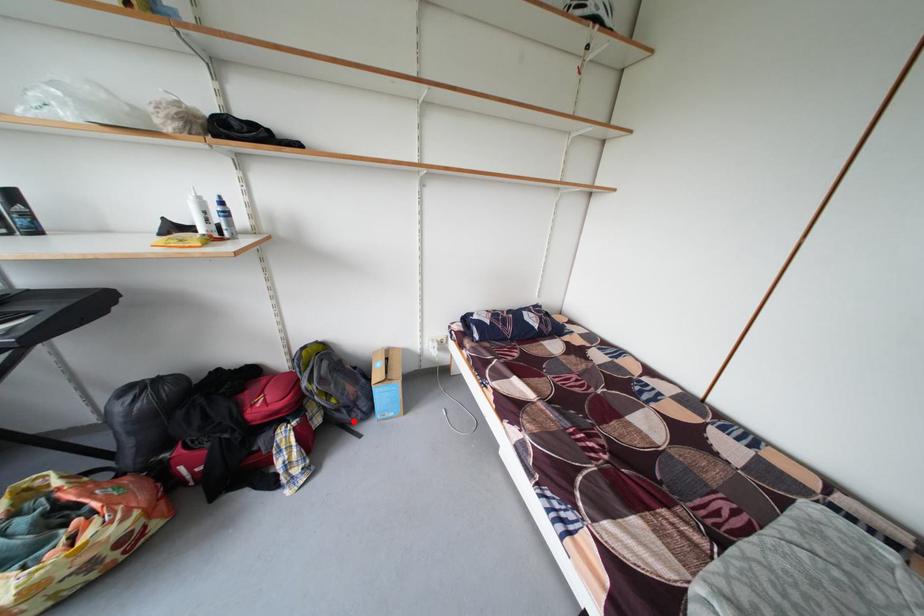
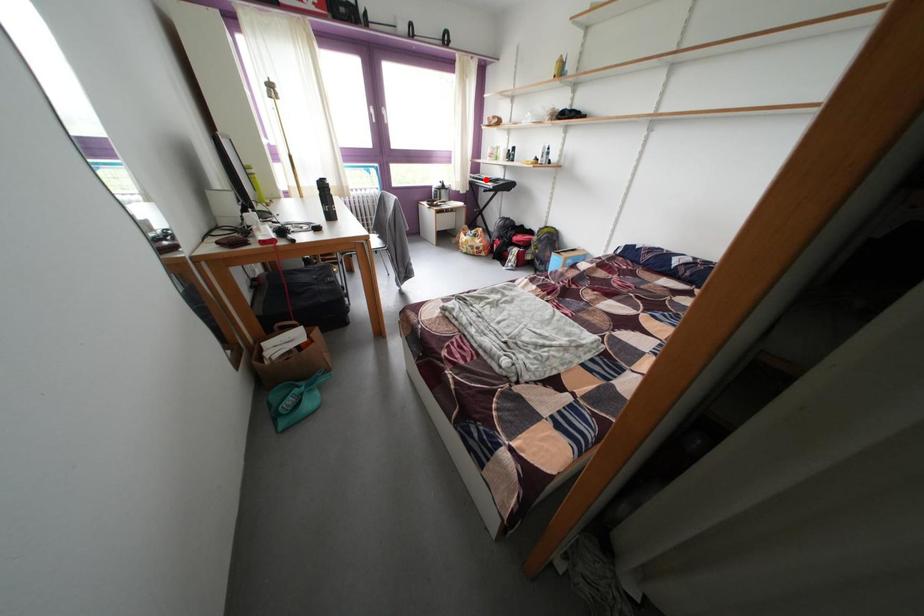
I am providing you with two images of the same scene from different viewpoints. A red point is marked on the first image and another point is marked on the second image. Is the red point in image1 aligned with the point shown in image2?

No